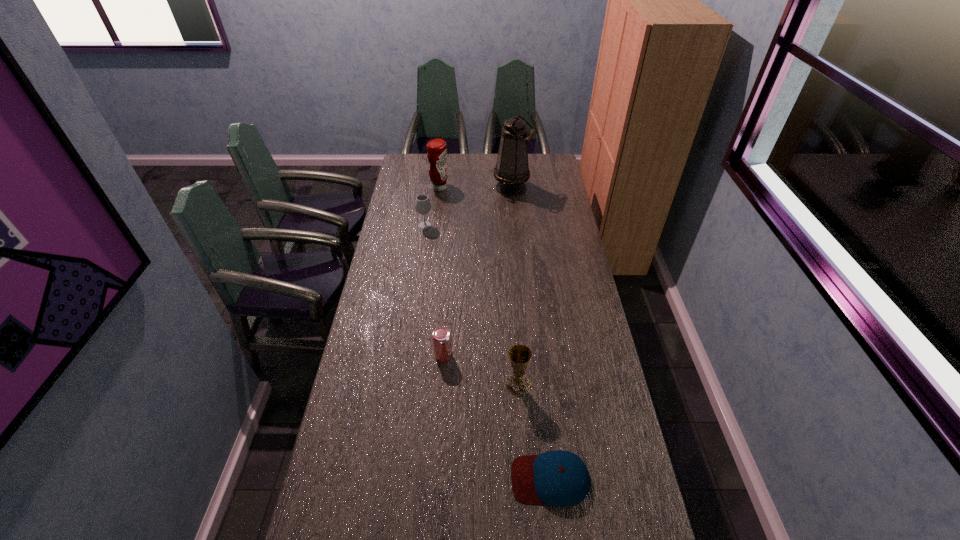
Locate an element on the screen. vacant point at the far left corner is located at coordinates (425, 174).

This screenshot has height=540, width=960. In the image, there is a desktop. In order to click on vacant space at the far right corner in this screenshot , I will do `click(535, 164)`.

This screenshot has width=960, height=540. I want to click on vacant area between the nearest object and the third nearest object, so click(x=496, y=417).

Where is `vacant area between the chalice and the tallest object`? This screenshot has width=960, height=540. vacant area between the chalice and the tallest object is located at coordinates (515, 286).

Find the location of a particular element. free area in between the wineglass and the tallest object is located at coordinates pyautogui.click(x=468, y=207).

What are the coordinates of `free space between the tallest object and the shortest object` in the screenshot? It's located at click(x=531, y=334).

What are the coordinates of `free space between the baseball cap and the tallest object` in the screenshot? It's located at (531, 334).

The image size is (960, 540). Identify the location of empty space that is in between the second tallest object and the third object from left to right. (442, 271).

Where is `empty location between the wineglass and the tallest object`? The height and width of the screenshot is (540, 960). empty location between the wineglass and the tallest object is located at coordinates (468, 207).

The image size is (960, 540). I want to click on vacant area that lies between the oil lamp and the third farthest object, so click(468, 207).